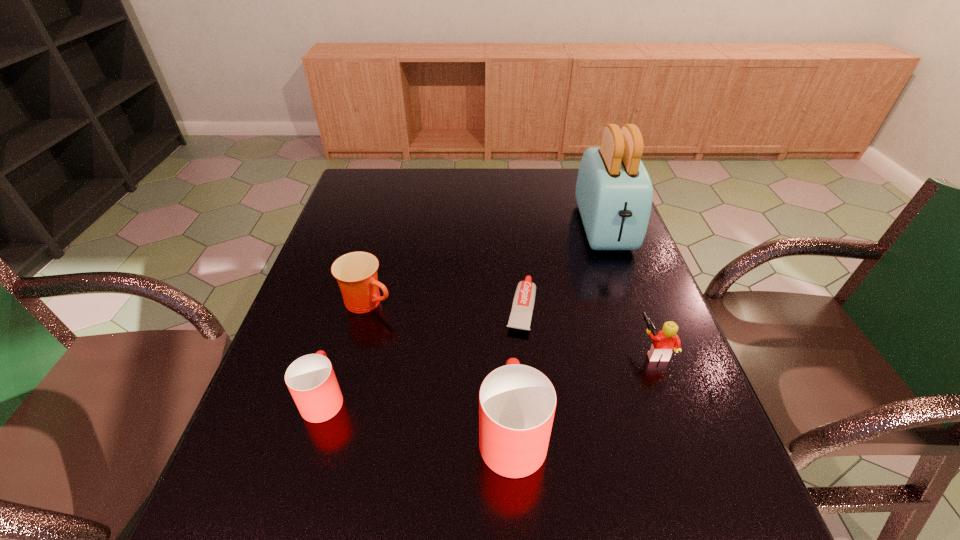
Locate an element on the screen. This screenshot has width=960, height=540. the rightmost cup is located at coordinates (517, 403).

You are a GUI agent. You are given a task and a screenshot of the screen. Output one action in this format:
    pyautogui.click(x=<x>, y=<y>)
    Task: Click on the second tallest object
    
    Given the screenshot: What is the action you would take?
    pyautogui.click(x=517, y=403)

Find the location of a particular element. The width and height of the screenshot is (960, 540). toaster is located at coordinates (614, 193).

Locate an element on the screen. the farthest object is located at coordinates (614, 193).

Locate an element on the screen. This screenshot has width=960, height=540. the third nearest object is located at coordinates (664, 342).

This screenshot has width=960, height=540. I want to click on the shortest object, so click(520, 317).

Identify the location of the farthest cup. The height and width of the screenshot is (540, 960). point(356,272).

The width and height of the screenshot is (960, 540). Identify the location of free space located 0.200m on the side of the rightmost cup with the handle. (506, 321).

You are a GUI agent. You are given a task and a screenshot of the screen. Output one action in this format:
    pyautogui.click(x=<x>, y=<y>)
    Task: Click on the vacant space located 0.060m on the side of the rightmost cup with the handle
    This screenshot has height=540, width=960.
    Given the screenshot: What is the action you would take?
    pyautogui.click(x=509, y=368)

Find the location of `free space located 0.050m on the side of the rightmost cup with the handle`. free space located 0.050m on the side of the rightmost cup with the handle is located at coordinates (509, 372).